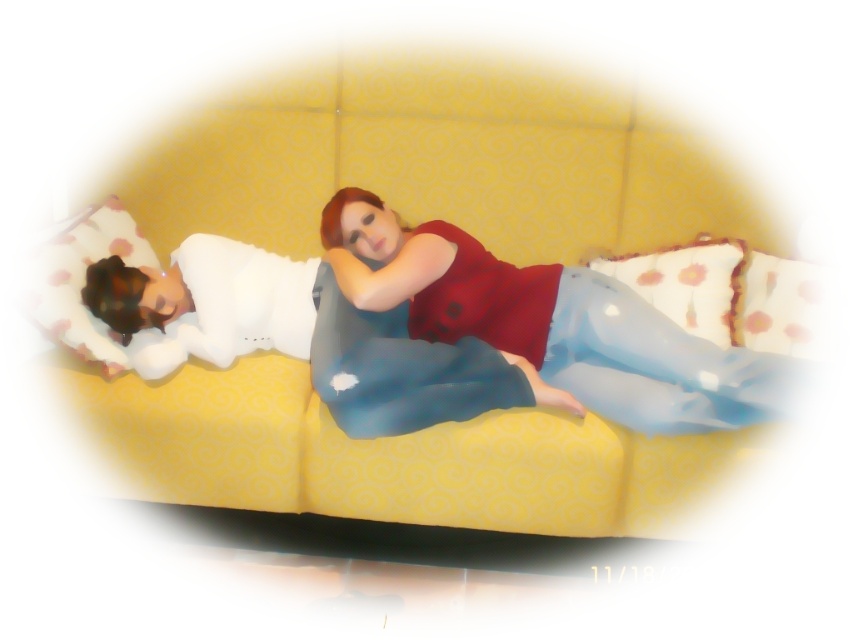
You are designing a new arrangement for a living room and want to place a matte red blouse at center and a white fluffy pillow at left. Given their sizes, which object should be placed first to ensure they fit properly?

The matte red blouse at center is wider than the white fluffy pillow at left, so you should place the wider matte red blouse at center first to ensure proper fitting.